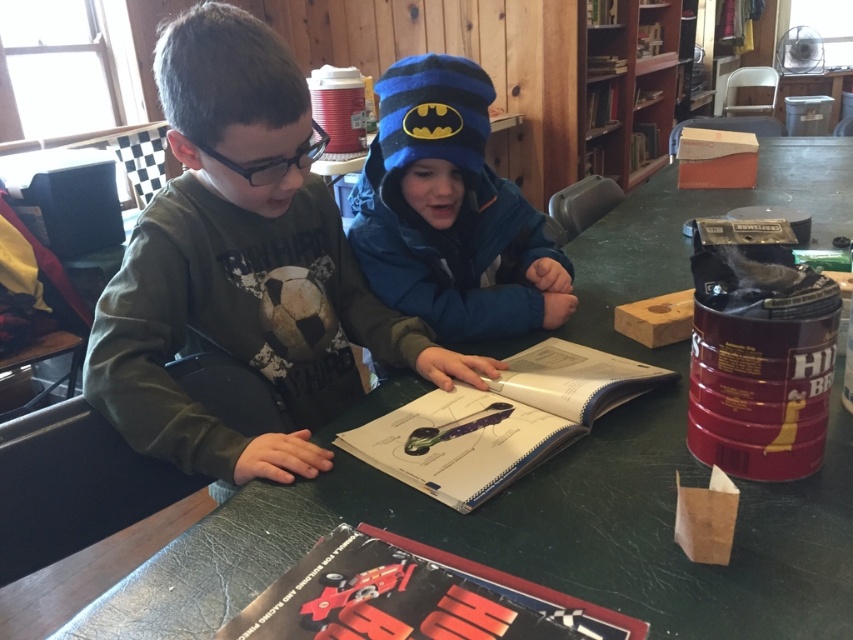
You are a photographer trying to capture a closeup of the green matte shirt at left and the wooden bookshelf at upper center. Since you want both to be in focus, you need to know which object is closer to the camera. Which one is closer?

The green matte shirt at left is closer to the camera than the wooden bookshelf at upper center because it is thinner, indicating it is nearer to the lens.

You are a librarian who needs to place a new book on the shelf. The wooden bookshelf at upper center is 1.2 meters tall. The red glossy book at center is 20 cm thick. Can the book fit vertically on the shelf?

The wooden bookshelf at upper center is 1.2 meters tall, and the red glossy book at center is only 20 cm thick. Since 20 cm is much shorter than 1.2 meters, the book can fit vertically on the shelf.